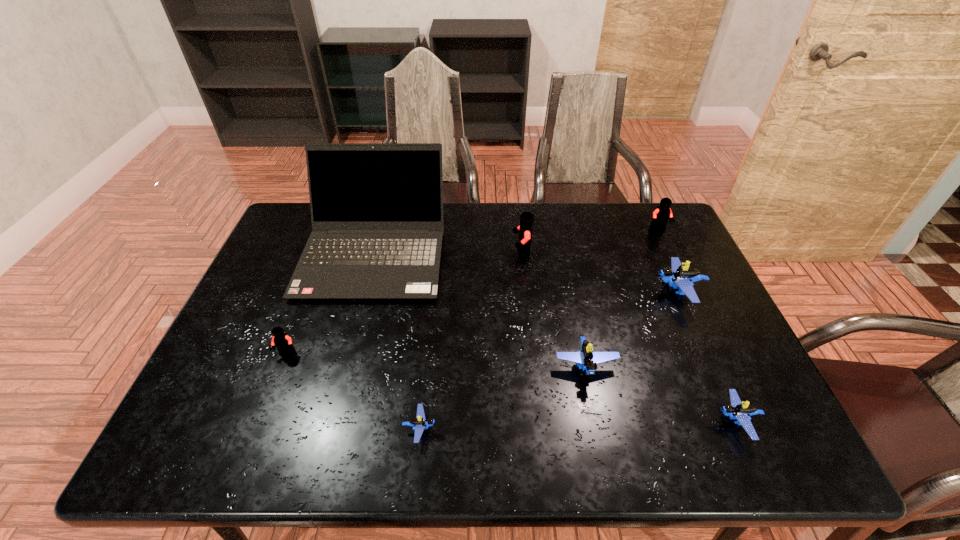
Identify the location of vacant area at the far left corner. This screenshot has width=960, height=540. (297, 215).

You are a GUI agent. You are given a task and a screenshot of the screen. Output one action in this format:
    pyautogui.click(x=<x>, y=<y>)
    Task: Click on the vacant space at the near left corner of the desktop
    
    Given the screenshot: What is the action you would take?
    pyautogui.click(x=208, y=426)

Where is `free space that is in between the laptop computer and the second Lego from left to right`? The width and height of the screenshot is (960, 540). free space that is in between the laptop computer and the second Lego from left to right is located at coordinates (397, 340).

The height and width of the screenshot is (540, 960). I want to click on free space between the fourth Lego from left to right and the second smallest blue Lego, so click(660, 394).

Where is `free space that is in between the leftmost black Lego and the fourth object from left to right`? The height and width of the screenshot is (540, 960). free space that is in between the leftmost black Lego and the fourth object from left to right is located at coordinates (404, 302).

Find the location of a particular element. empty location between the leftmost blue Lego and the biggest blue Lego is located at coordinates (549, 360).

This screenshot has width=960, height=540. Identify the location of free space between the biggest black Lego and the second shortest object. (629, 337).

Locate an element on the screen. The width and height of the screenshot is (960, 540). vacant space that's between the second Lego from left to right and the fourth Lego from left to right is located at coordinates (503, 397).

The image size is (960, 540). I want to click on free space between the biggest black Lego and the black laptop computer, so click(448, 252).

Locate an element on the screen. vacant area that lies between the fourth Lego from left to right and the black laptop computer is located at coordinates (480, 309).